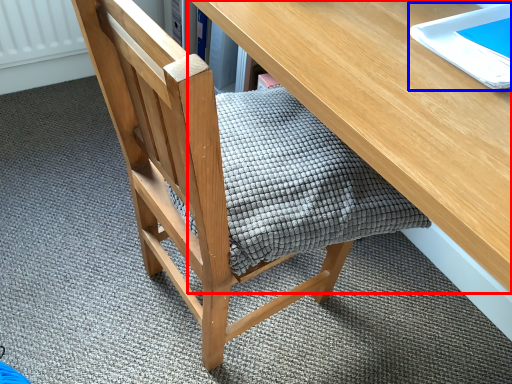
Question: Which of the following is the farthest to the observer, desk (highlighted by a red box) or notebook (highlighted by a blue box)?

Choices:
 (A) desk
 (B) notebook

Answer: (B)